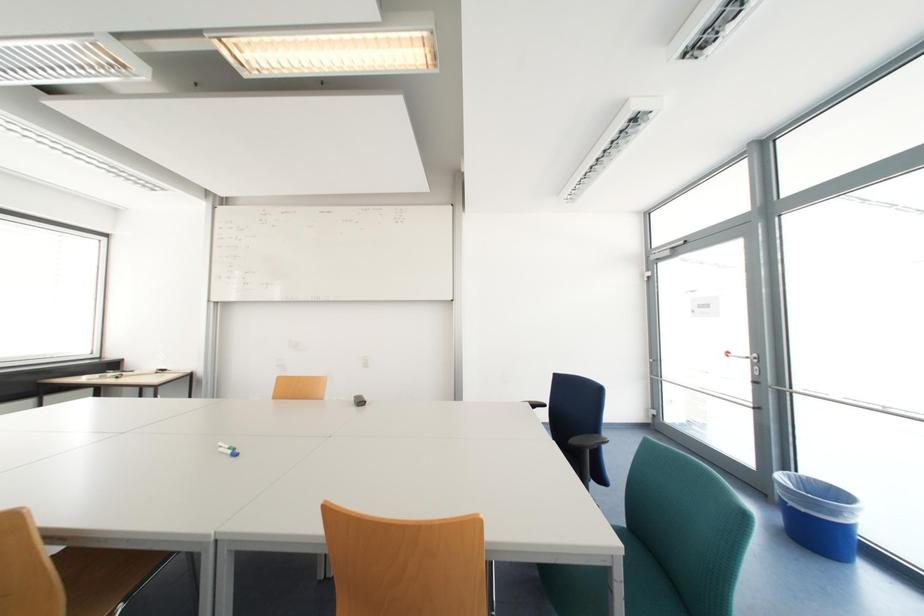
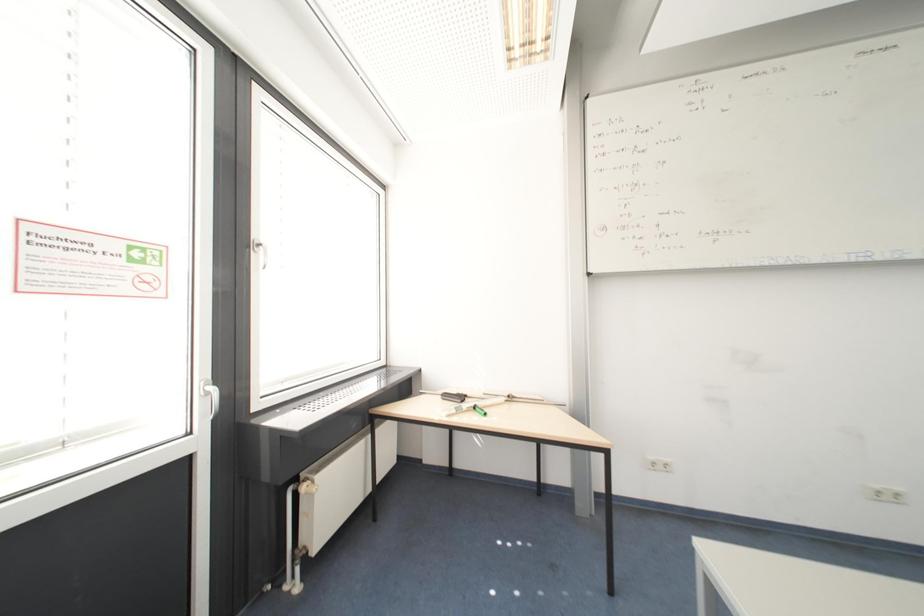
What movement of the cameraman would produce the second image?

The movement direction of the cameraman is left, forward.